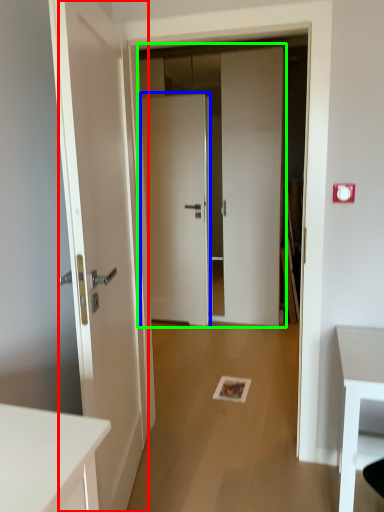
Question: Which is farther away from door (highlighted by a red box)? door (highlighted by a blue box) or door (highlighted by a green box)?

Choices:
 (A) door
 (B) door

Answer: (A)